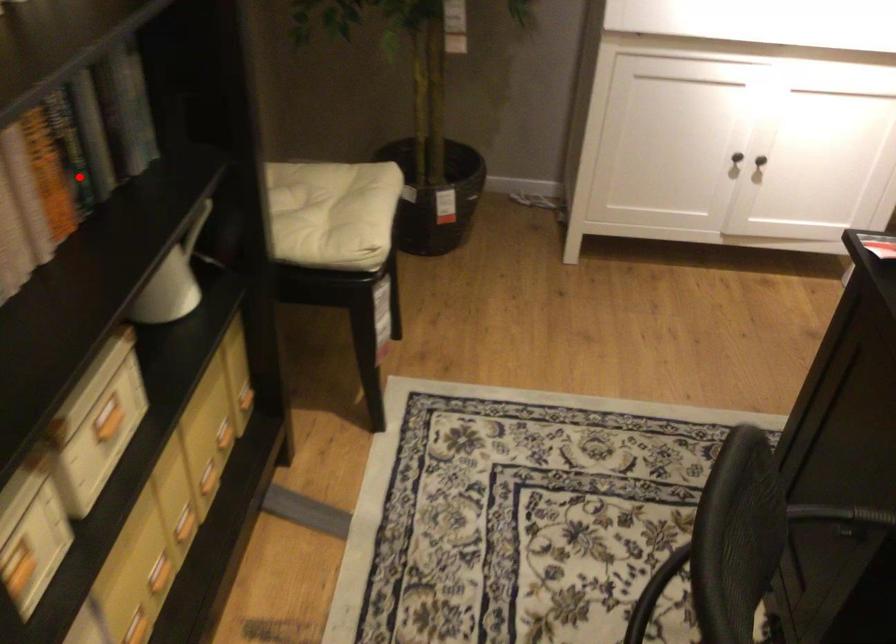
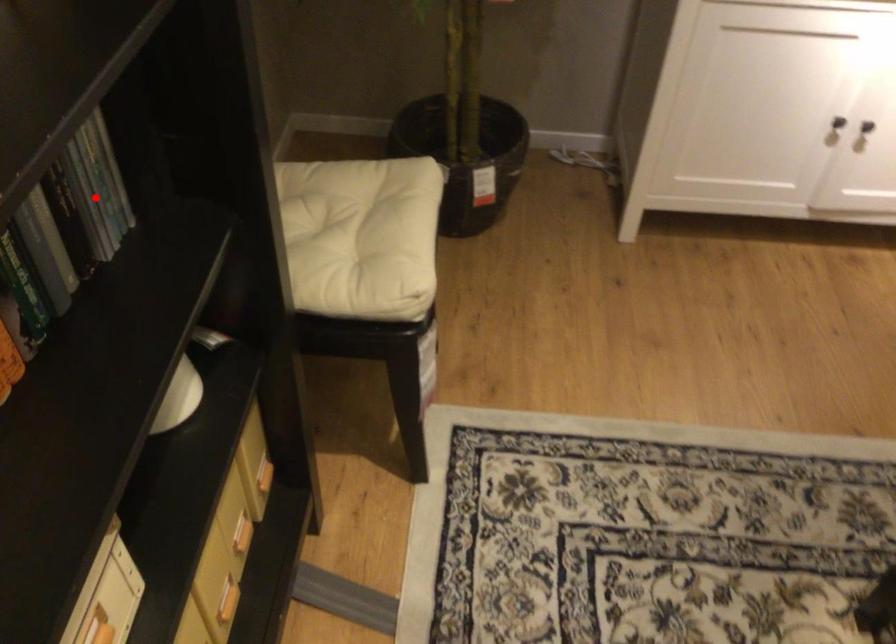
Based on the photo, I am providing you with two images of the same scene from different viewpoints. A red point is marked on the first image and another point is marked on the second image. Are the points marked in image1 and image2 representing the same 3D position?

No